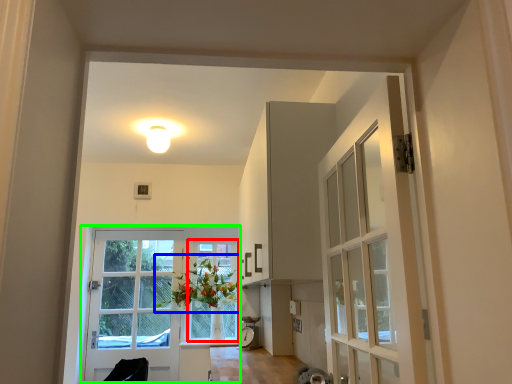
Question: Estimate the real-world distances between objects in this image. Which object is closer to window frame (highlighted by a red box), floral arrangement (highlighted by a blue box) or door (highlighted by a green box)?

Choices:
 (A) floral arrangement
 (B) door

Answer: (A)